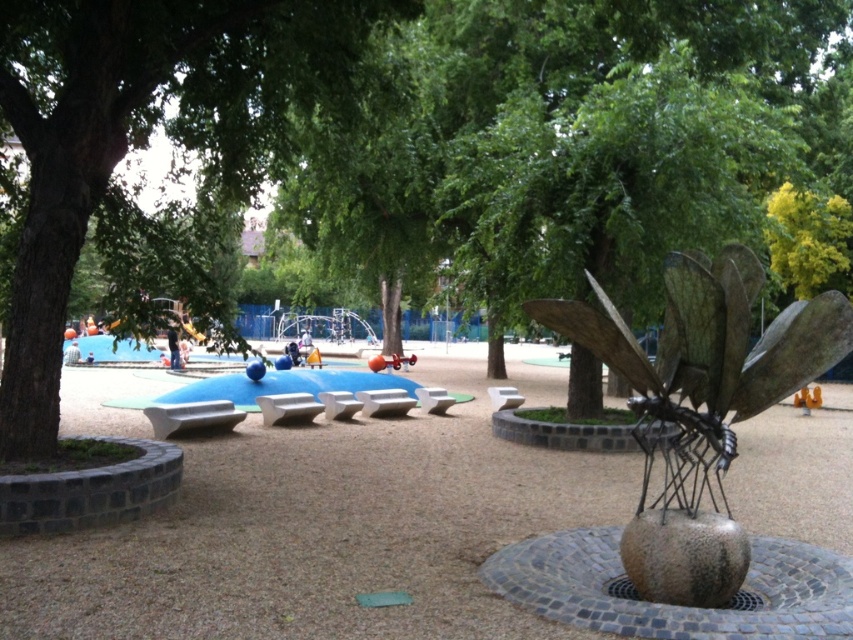
Can you confirm if green leafy tree at left is positioned below bronze metallic dragonfly at center?

No.

Which is in front, point (247, 177) or point (645, 413)?

Point (645, 413) is in front.

Does point (206, 314) come in front of point (695, 432)?

No, (206, 314) is further to viewer.

At what (x,y) coordinates should I click in order to perform the action: click on green leafy tree at left. Please return your answer as a coordinate pair (x, y). This screenshot has height=640, width=853. Looking at the image, I should click on (142, 141).